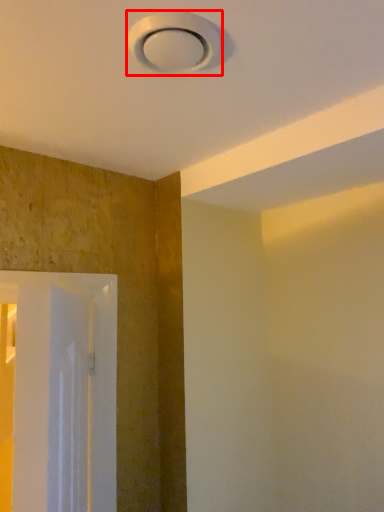
Question: From the image's perspective, considering the relative positions of lamp (annotated by the red box) and screen door in the image provided, where is lamp (annotated by the red box) located with respect to the staircase?

Choices:
 (A) below
 (B) above

Answer: (B)